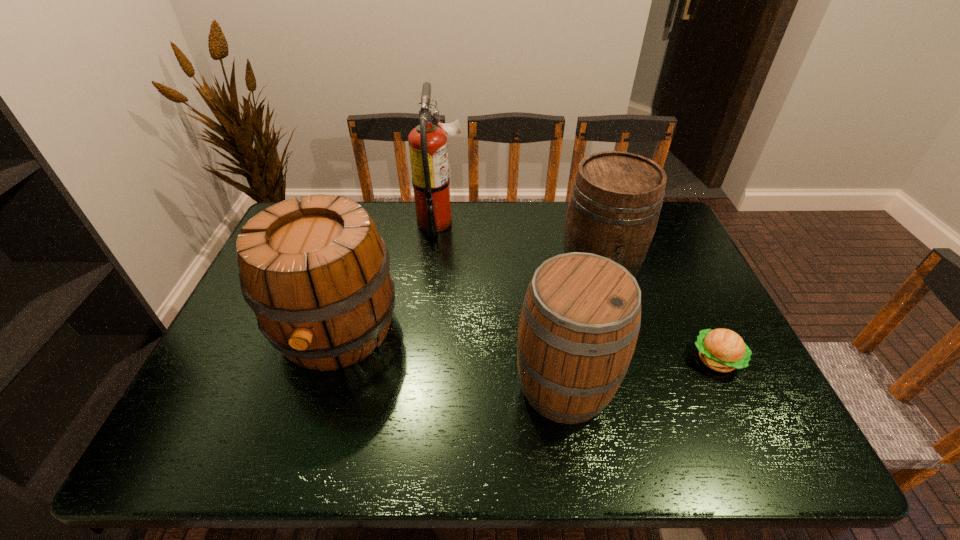
At what (x,y) coordinates should I click in order to perform the action: click on cider that stands as the closest to the farthest object. Please return your answer as a coordinate pair (x, y). The height and width of the screenshot is (540, 960). Looking at the image, I should click on (316, 274).

Image resolution: width=960 pixels, height=540 pixels. What are the coordinates of `cider that is the closest to the fire extinguisher` in the screenshot? It's located at (316, 274).

Find the location of `free spot that satisfies the following two spatial constraints: 1. on the side of the rightmost object where the spigot is located; 2. on the left side of the leftmost cider`. free spot that satisfies the following two spatial constraints: 1. on the side of the rightmost object where the spigot is located; 2. on the left side of the leftmost cider is located at coordinates (327, 360).

The height and width of the screenshot is (540, 960). In order to click on vacant space that satisfies the following two spatial constraints: 1. from the nozzle of the fire extinguisher; 2. on the side of the leftmost cider where the spigot is located in this screenshot , I will do `click(428, 330)`.

Find the location of a particular element. The height and width of the screenshot is (540, 960). free location that satisfies the following two spatial constraints: 1. on the side of the hamburger where the spigot is located; 2. on the left side of the leftmost cider is located at coordinates (327, 360).